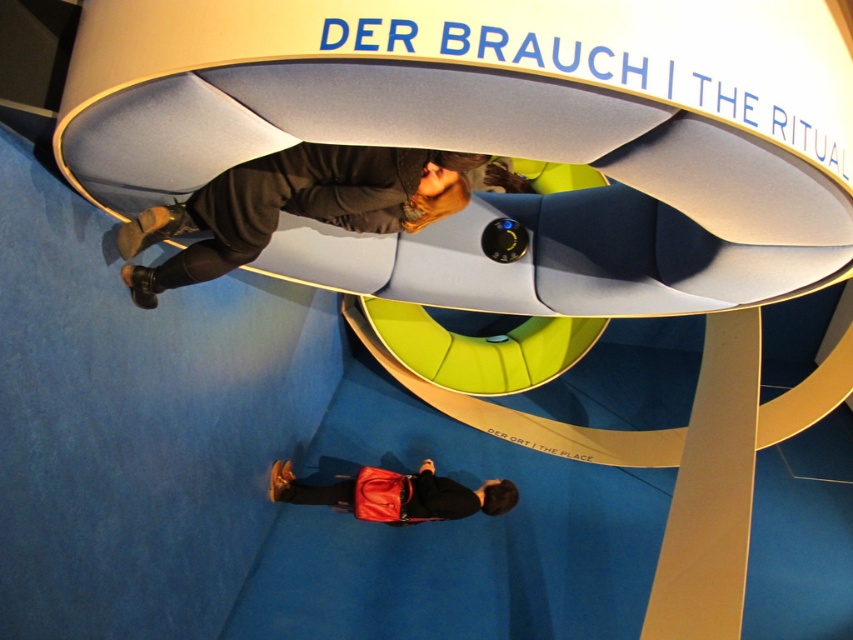
Does dark gray hoodie at upper center have a lesser height compared to matte red bag at lower center?

In fact, dark gray hoodie at upper center may be taller than matte red bag at lower center.

Is point (204, 202) positioned behind point (277, 472)?

No, (204, 202) is in front of (277, 472).

Where is `dark gray hoodie at upper center`? The width and height of the screenshot is (853, 640). dark gray hoodie at upper center is located at coordinates (294, 205).